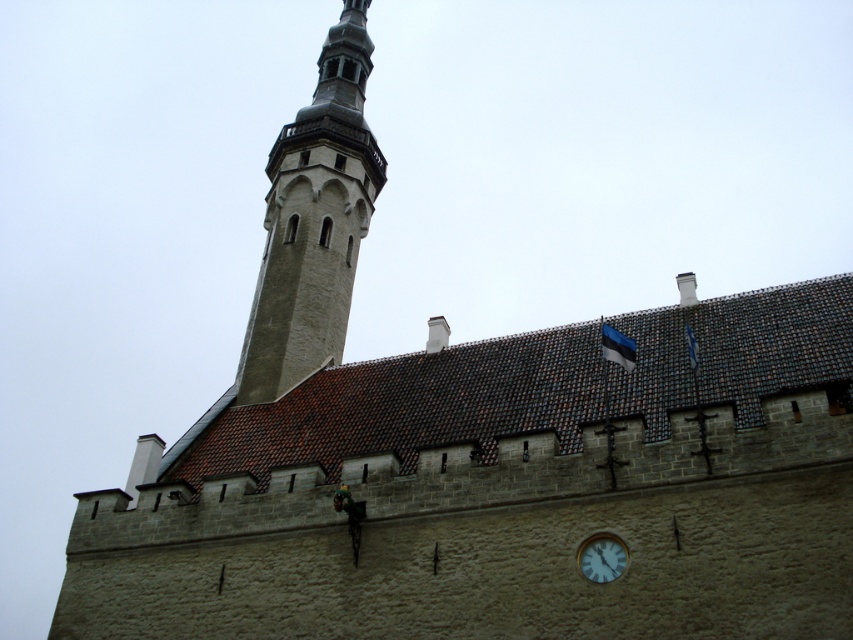
You are a tourist standing in front of the historic building. You notice the smooth stone tower at upper left and the white plastic clock at lower right. Which object is taller?

The smooth stone tower at upper left is taller than the white plastic clock at lower right according to the description.

You are standing in front of the historic building and want to take a photo of the white plastic clock at lower right without the smooth stone tower at upper left blocking it. How should you position yourself?

Move to the right side of the building so that the white plastic clock at lower right is no longer behind the smooth stone tower at upper left.

You are standing at point (614, 564) and want to walk to the historic building in the image. Is the point (283, 323) between you and the building?

Point (283, 323) is behind point (614, 564), so it is not between you and the building. You can proceed directly towards the building without obstruction from point (283, 323).